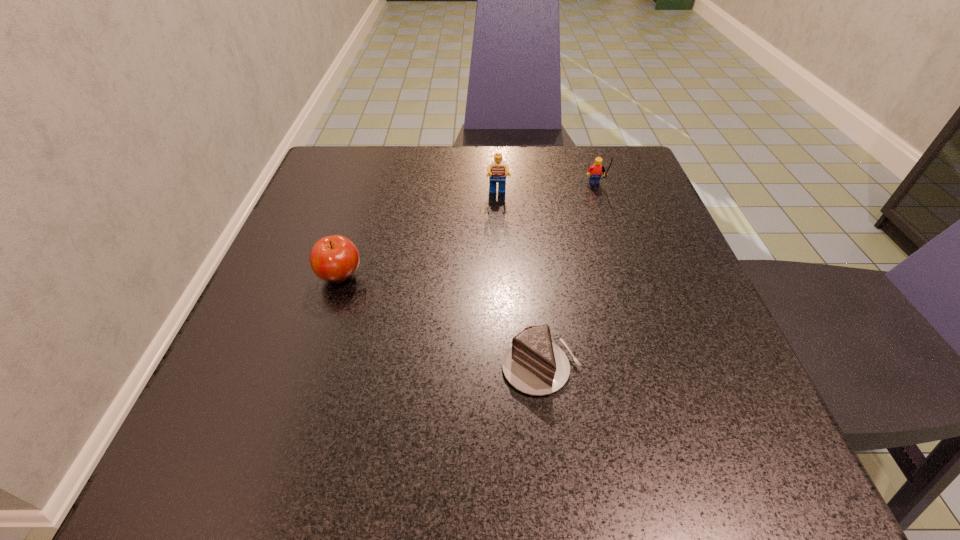
Image resolution: width=960 pixels, height=540 pixels. I want to click on object that is at the left edge, so click(x=335, y=258).

At what (x,y) coordinates should I click in order to perform the action: click on object that is at the right edge. Please return your answer as a coordinate pair (x, y). Image resolution: width=960 pixels, height=540 pixels. Looking at the image, I should click on (596, 169).

You are a GUI agent. You are given a task and a screenshot of the screen. Output one action in this format:
    pyautogui.click(x=<x>, y=<y>)
    Task: Click on the object present at the far right corner
    This screenshot has width=960, height=540.
    Given the screenshot: What is the action you would take?
    pyautogui.click(x=596, y=169)

Where is `blank space at the far edge of the desktop`? The width and height of the screenshot is (960, 540). blank space at the far edge of the desktop is located at coordinates (432, 193).

This screenshot has height=540, width=960. In order to click on free location at the near edge in this screenshot , I will do [x=545, y=467].

This screenshot has width=960, height=540. Identify the location of vacant position at the left edge of the desktop. (273, 271).

The width and height of the screenshot is (960, 540). I want to click on free space at the right edge, so (x=746, y=390).

This screenshot has width=960, height=540. In the image, there is a desktop. In order to click on vacant space at the near left corner in this screenshot , I will do click(211, 458).

The height and width of the screenshot is (540, 960). Identify the location of vacant space at the far right corner of the desktop. (630, 191).

At what (x,y) coordinates should I click in order to perform the action: click on free space that is in between the shortest object and the rightmost object. Please return your answer as a coordinate pair (x, y). The height and width of the screenshot is (540, 960). Looking at the image, I should click on (568, 278).